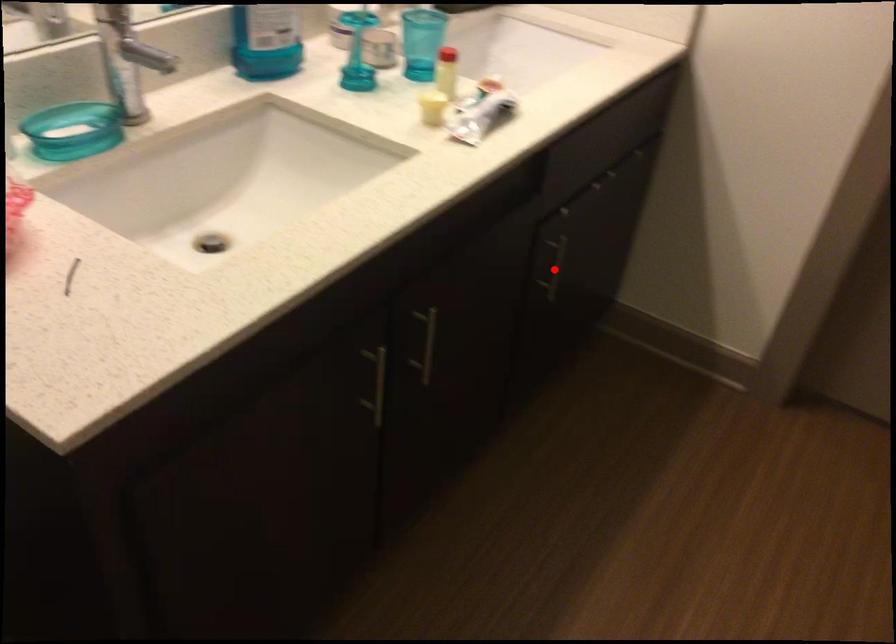
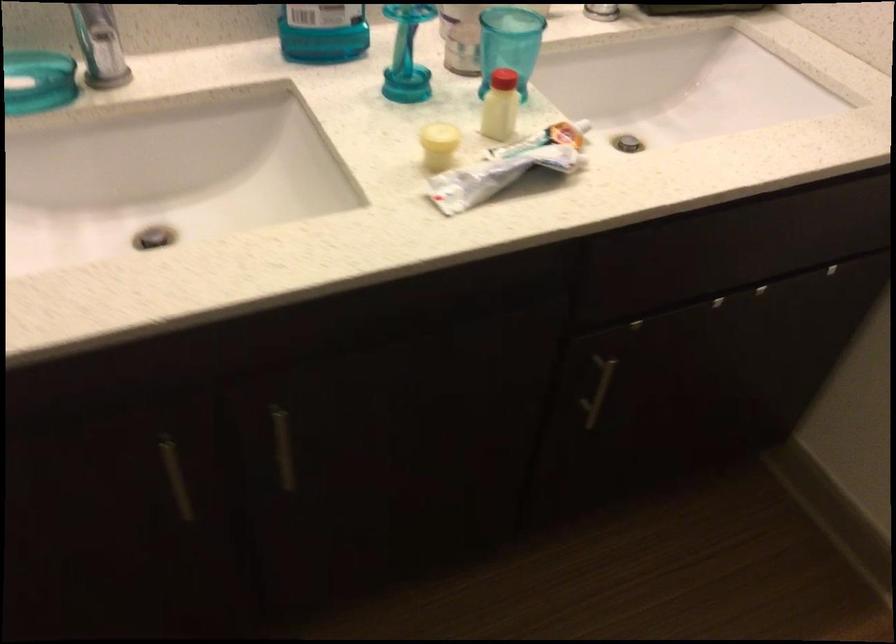
Question: I am providing you with two images of the same scene from different viewpoints. Given a red point in image1, look at the same physical point in image2. Is it:

Choices:
 (A) Closer to the viewpoint
 (B) Farther from the viewpoint

Answer: (A)